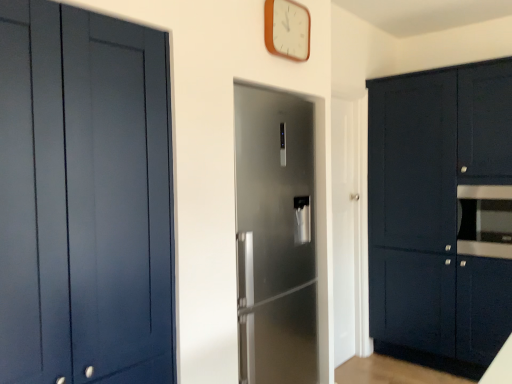
Question: Is satin black oven at right bigger than white glossy door at center, placed as the 2th door when sorted from front to back?

Choices:
 (A) no
 (B) yes

Answer: (A)

Question: Considering the relative sizes of satin black oven at right and white glossy door at center, marked as the 2th door in a left-to-right arrangement, in the image provided, is satin black oven at right smaller than white glossy door at center, marked as the 2th door in a left-to-right arrangement,?

Choices:
 (A) yes
 (B) no

Answer: (A)

Question: Can we say satin black oven at right lies outside white glossy door at center, which is counted as the 1th door, starting from the right?

Choices:
 (A) no
 (B) yes

Answer: (B)

Question: Considering the relative sizes of satin black oven at right and white glossy door at center, the 1th door positioned from the back, in the image provided, is satin black oven at right shorter than white glossy door at center, the 1th door positioned from the back,?

Choices:
 (A) no
 (B) yes

Answer: (B)

Question: Is satin black oven at right to the right of white glossy door at center, the 1th door positioned from the back, from the viewer's perspective?

Choices:
 (A) yes
 (B) no

Answer: (A)

Question: Does point (432, 104) appear closer or farther from the camera than point (496, 215)?

Choices:
 (A) farther
 (B) closer

Answer: (A)

Question: Is matte dark blue cabinets at right, which ranks as the 1th cabinetry in back-to-front order, taller or shorter than satin black oven at right?

Choices:
 (A) short
 (B) tall

Answer: (B)

Question: Looking at their shapes, would you say matte dark blue cabinets at right, the first cabinetry in the right-to-left sequence, is wider or thinner than satin black oven at right?

Choices:
 (A) thin
 (B) wide

Answer: (B)

Question: Is matte dark blue cabinets at right, the second cabinetry positioned from the left, bigger or smaller than satin black oven at right?

Choices:
 (A) big
 (B) small

Answer: (A)

Question: Would you say matte blue cabinet at left, which is the 2th cabinetry from back to front, is inside or outside white wooden clock at upper center?

Choices:
 (A) outside
 (B) inside

Answer: (A)

Question: In the image, is matte blue cabinet at left, which appears as the 1th cabinetry when viewed from the front, positioned in front of or behind white wooden clock at upper center?

Choices:
 (A) front
 (B) behind

Answer: (A)

Question: From a real-world perspective, is matte blue cabinet at left, the first cabinetry in the left-to-right sequence, physically located above or below white wooden clock at upper center?

Choices:
 (A) below
 (B) above

Answer: (A)

Question: Looking at the image, does matte blue cabinet at left, which appears as the 1th cabinetry when viewed from the front, seem bigger or smaller compared to white wooden clock at upper center?

Choices:
 (A) small
 (B) big

Answer: (B)

Question: Is matte blue cabinet at left, which is the 2th cabinetry from back to front, taller or shorter than white glossy door at center, which is counted as the 1th door, starting from the right?

Choices:
 (A) short
 (B) tall

Answer: (A)

Question: From the image's perspective, is matte blue cabinet at left, the first cabinetry in the left-to-right sequence, positioned above or below white glossy door at center, placed as the 2th door when sorted from front to back?

Choices:
 (A) below
 (B) above

Answer: (B)